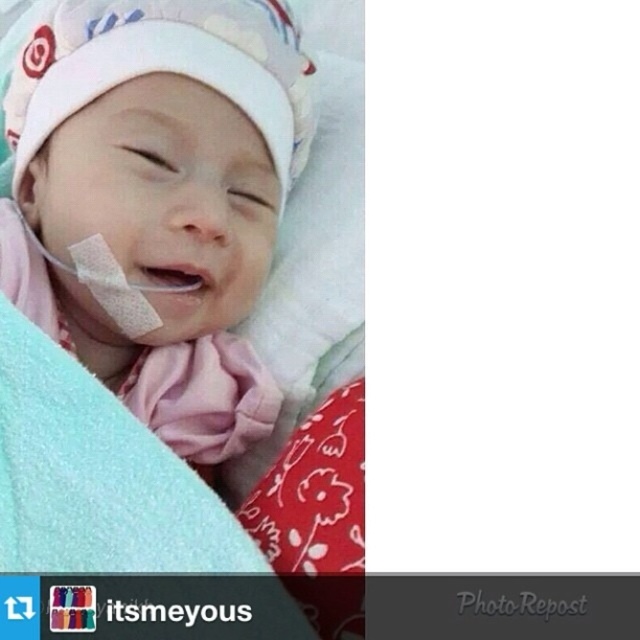
Question: Which point appears farthest from the camera in this image?

Choices:
 (A) (193, 310)
 (B) (74, 500)

Answer: (A)

Question: Is white soft hat at upper center thinner than light blue soft blanket at center?

Choices:
 (A) no
 (B) yes

Answer: (A)

Question: Which point is closer to the camera?

Choices:
 (A) light blue soft blanket at center
 (B) white soft hat at upper center
 (C) white adhesive bandage at center

Answer: (A)

Question: Based on their relative distances, which object is nearer to the light blue soft blanket at center?

Choices:
 (A) white adhesive bandage at center
 (B) white soft hat at upper center

Answer: (A)

Question: Can you confirm if white soft hat at upper center is positioned to the left of light blue soft blanket at center?

Choices:
 (A) no
 (B) yes

Answer: (A)

Question: Can you confirm if white soft hat at upper center is wider than white adhesive bandage at center?

Choices:
 (A) no
 (B) yes

Answer: (B)